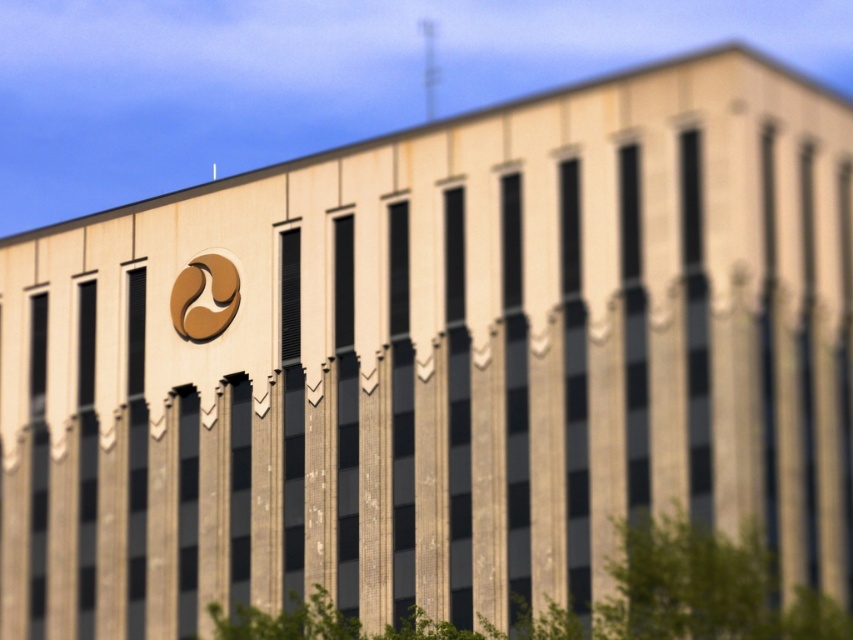
You are standing in front of the building and want to determine the relative positions of two points marked on the facade. Based on the image, which point is closer to you, point at coordinates [674,572] or point at coordinates [192,285]?

Point at coordinates [674,572] is in front of point at coordinates [192,285], so it is closer to you.

You are a photographer standing in front of the building. You want to capture a photo where the gold metallic logo at upper center is centered in the frame. However, the green leafy tree at lower center might block part of the logo. Based on their positions, will the tree block the logo when you center the logo?

The green leafy tree at lower center is to the right of the gold metallic logo at upper center. When you center the gold metallic logo at upper center in the frame, the tree will be positioned to the right of the logo and therefore will not block it.